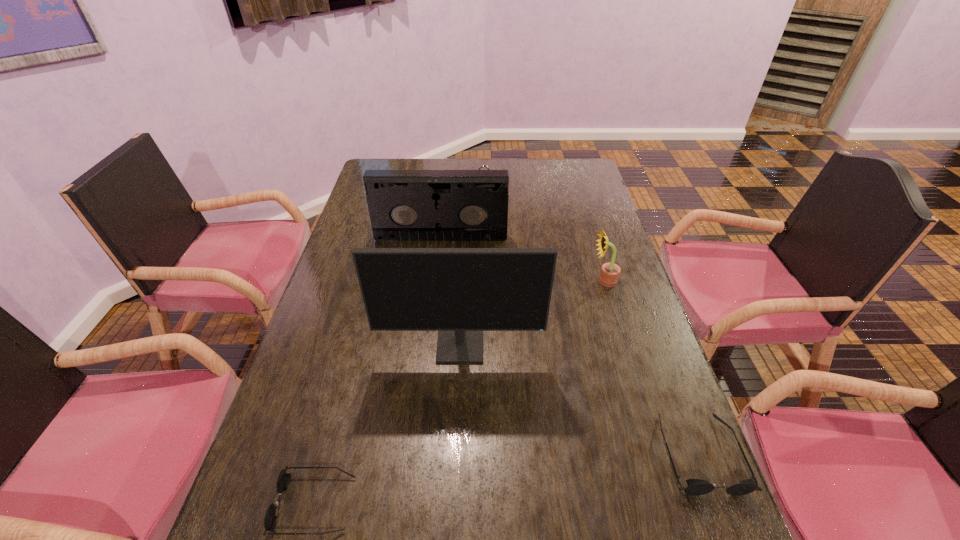
Identify the location of the shortest object. This screenshot has width=960, height=540. (283, 480).

Locate an element on the screen. The image size is (960, 540). the left sunglasses is located at coordinates (283, 480).

At what (x,y) coordinates should I click in order to perform the action: click on the right sunglasses. Please return your answer as a coordinate pair (x, y). Image resolution: width=960 pixels, height=540 pixels. Looking at the image, I should click on 695,487.

At what (x,y) coordinates should I click in order to perform the action: click on the fifth tallest object. Please return your answer as a coordinate pair (x, y). Looking at the image, I should click on (695, 487).

Where is `the farthest object`? The width and height of the screenshot is (960, 540). the farthest object is located at coordinates (481, 166).

The width and height of the screenshot is (960, 540). Find the location of `the fourth tallest object`. the fourth tallest object is located at coordinates (481, 166).

You are a GUI agent. You are given a task and a screenshot of the screen. Output one action in this format:
    pyautogui.click(x=<x>, y=<y>)
    Task: Click on the second tallest object
    This screenshot has width=960, height=540.
    Given the screenshot: What is the action you would take?
    pyautogui.click(x=404, y=205)

Image resolution: width=960 pixels, height=540 pixels. In order to click on the fifth nearest object in this screenshot , I will do `click(404, 205)`.

At what (x,y) coordinates should I click in order to perform the action: click on sunflower. Please return your answer as a coordinate pair (x, y). The height and width of the screenshot is (540, 960). Looking at the image, I should click on (610, 272).

Identify the location of the fourth nearest object. (610, 272).